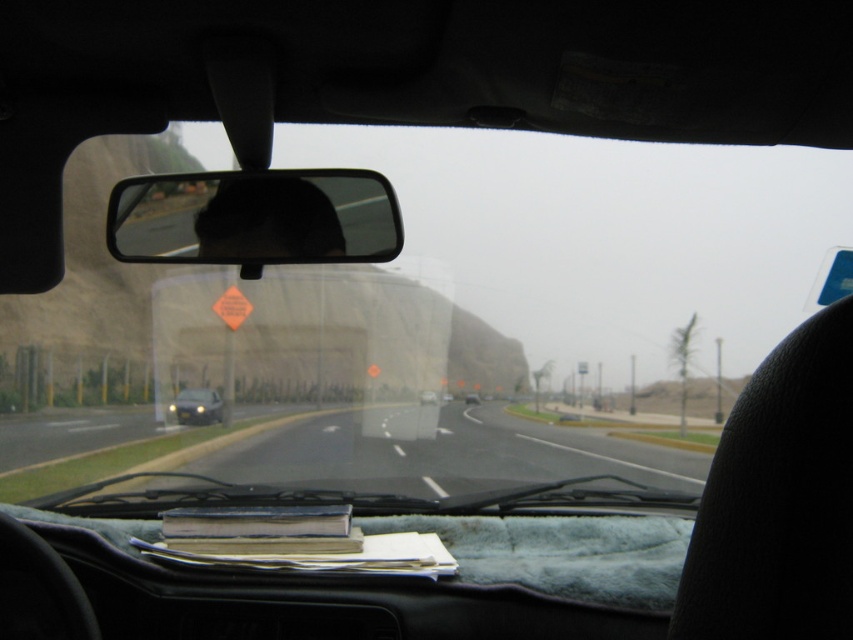
Who is more forward, (596, 253) or (165, 256)?

Point (165, 256) is more forward.

How distant is transparent glass windshield at center from black glossy rearview mirror at center?

The distance of transparent glass windshield at center from black glossy rearview mirror at center is 12.41 meters.

Does point (647, 184) lie behind point (387, 202)?

Yes.

Locate an element on the screen. transparent glass windshield at center is located at coordinates (428, 310).

Is black glossy rearview mirror at center below matte silver sedan at center?

Incorrect, black glossy rearview mirror at center is not positioned below matte silver sedan at center.

Between black glossy rearview mirror at center and matte silver sedan at center, which one has more height?

Standing taller between the two is matte silver sedan at center.

Where is `black glossy rearview mirror at center`? This screenshot has width=853, height=640. black glossy rearview mirror at center is located at coordinates click(254, 218).

Which is behind, point (379, 406) or point (128, 189)?

The point (379, 406) is more distant.

Who is higher up, black asphalt road at center or black glossy rearview mirror at center?

black glossy rearview mirror at center is higher up.

Find the location of `black asphalt road at center`. black asphalt road at center is located at coordinates (442, 452).